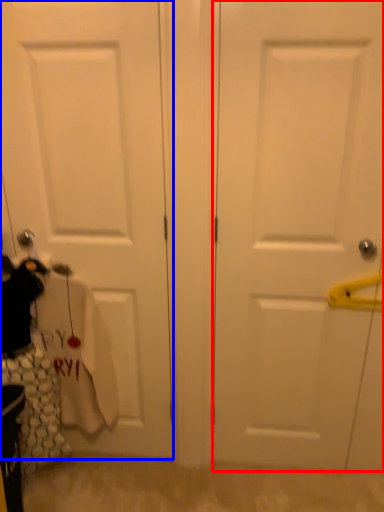
Question: Among these objects, which one is farthest to the camera, door (highlighted by a red box) or door (highlighted by a blue box)?

Choices:
 (A) door
 (B) door

Answer: (B)